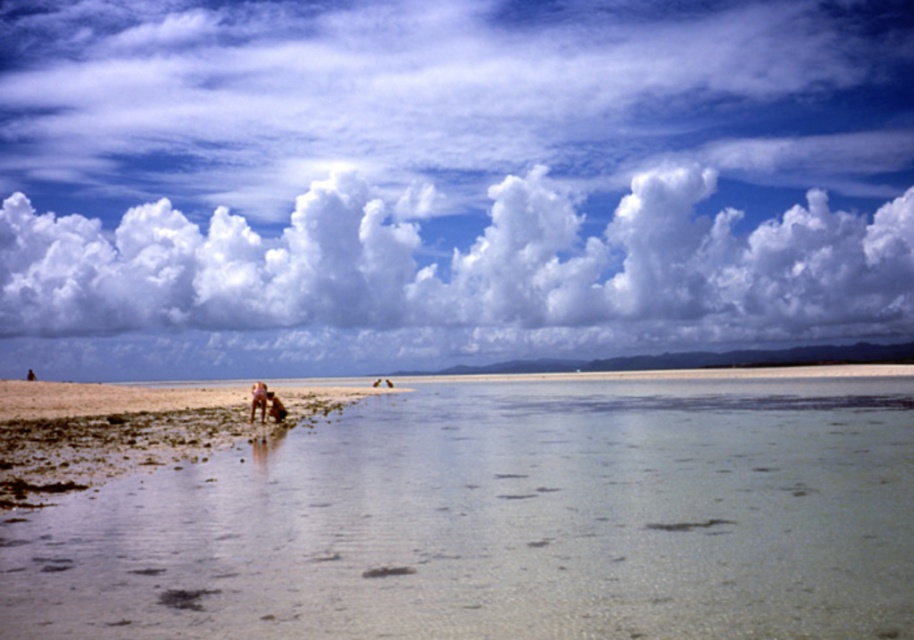
Can you confirm if light brown sand at lower left is positioned below brown leather bag at center?

Indeed, light brown sand at lower left is positioned under brown leather bag at center.

Between light brown sand at lower left and brown leather bag at center, which one is positioned lower?

light brown sand at lower left is lower down.

Where is `light brown sand at lower left`? The width and height of the screenshot is (914, 640). light brown sand at lower left is located at coordinates (128, 429).

Based on the photo, who is taller, light brown sand at lower left or beige fabric dog at center?

With more height is light brown sand at lower left.

Does point (187, 458) come closer to viewer compared to point (250, 417)?

Yes, it is.

Where is `light brown sand at lower left`? The height and width of the screenshot is (640, 914). light brown sand at lower left is located at coordinates (128, 429).

Is clear glass water at center above brown leather bag at center?

Incorrect, clear glass water at center is not positioned above brown leather bag at center.

Which is behind, point (418, 493) or point (275, 420)?

The point (275, 420) is more distant.

Locate an element on the screen. The height and width of the screenshot is (640, 914). clear glass water at center is located at coordinates [505, 522].